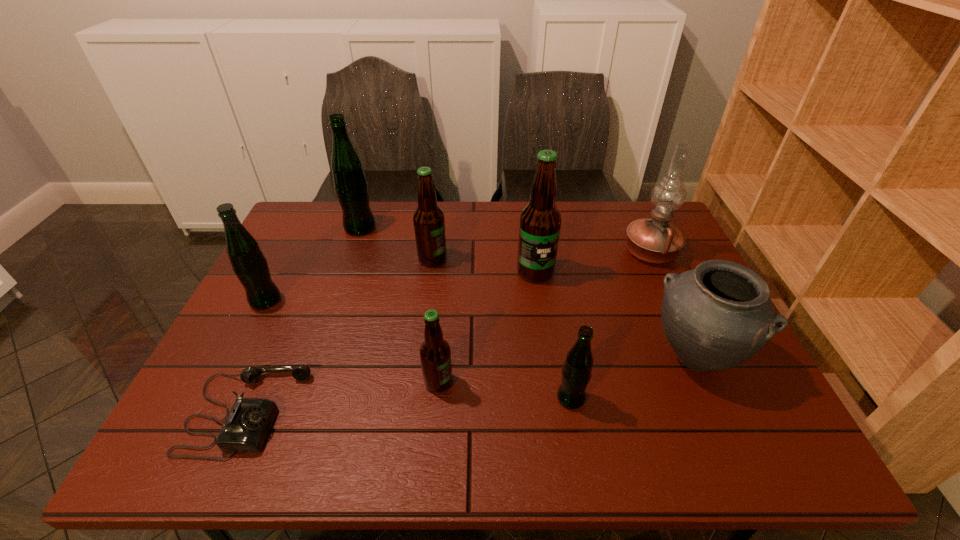
The height and width of the screenshot is (540, 960). I want to click on vacant area situated on the dial of the shortest object, so click(x=427, y=412).

Find the location of `beer bottle that is at the far edge`. beer bottle that is at the far edge is located at coordinates (350, 183).

You are a GUI agent. You are given a task and a screenshot of the screen. Output one action in this format:
    pyautogui.click(x=<x>, y=<y>)
    Task: Click on the oil lamp situated at the far edge
    
    Given the screenshot: What is the action you would take?
    pyautogui.click(x=655, y=240)

You are a GUI agent. You are given a task and a screenshot of the screen. Output one action in this format:
    pyautogui.click(x=<x>, y=<y>)
    Task: Click on the object that is at the near edge
    The height and width of the screenshot is (540, 960).
    Given the screenshot: What is the action you would take?
    pyautogui.click(x=248, y=423)

Locate an element on the screen. beer bottle positioned at the left edge is located at coordinates (248, 262).

Where is `telephone that is at the left edge`? The image size is (960, 540). telephone that is at the left edge is located at coordinates (248, 423).

Locate an element on the screen. This screenshot has width=960, height=540. oil lamp that is positioned at the right edge is located at coordinates (655, 240).

At what (x,y) coordinates should I click in order to perform the action: click on urn at the right edge. Please return your answer as a coordinate pair (x, y). Looking at the image, I should click on (715, 317).

At what (x,y) coordinates should I click in order to perform the action: click on object present at the near left corner. Please return your answer as a coordinate pair (x, y). The image size is (960, 540). Looking at the image, I should click on (248, 423).

Locate an element on the screen. This screenshot has width=960, height=540. object located at the far right corner is located at coordinates (655, 240).